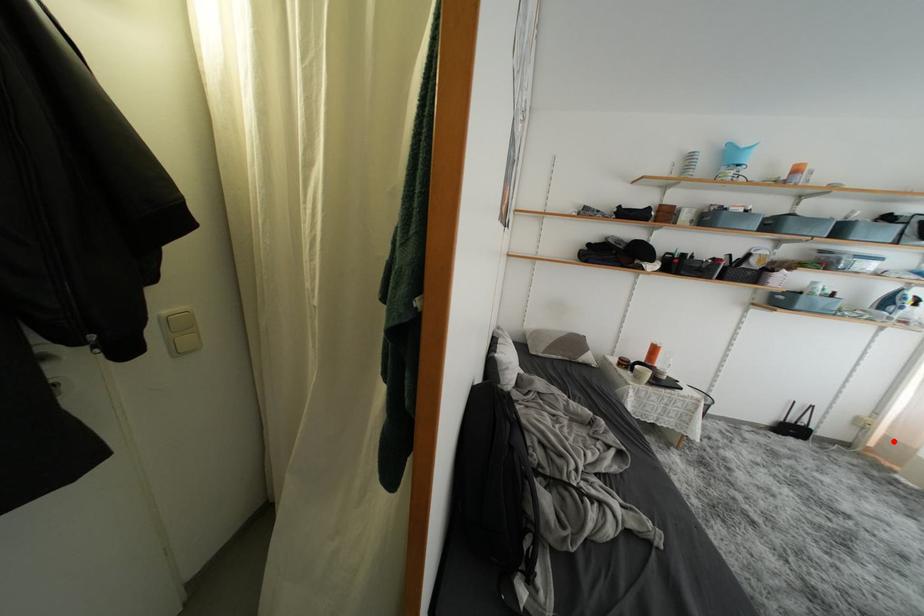
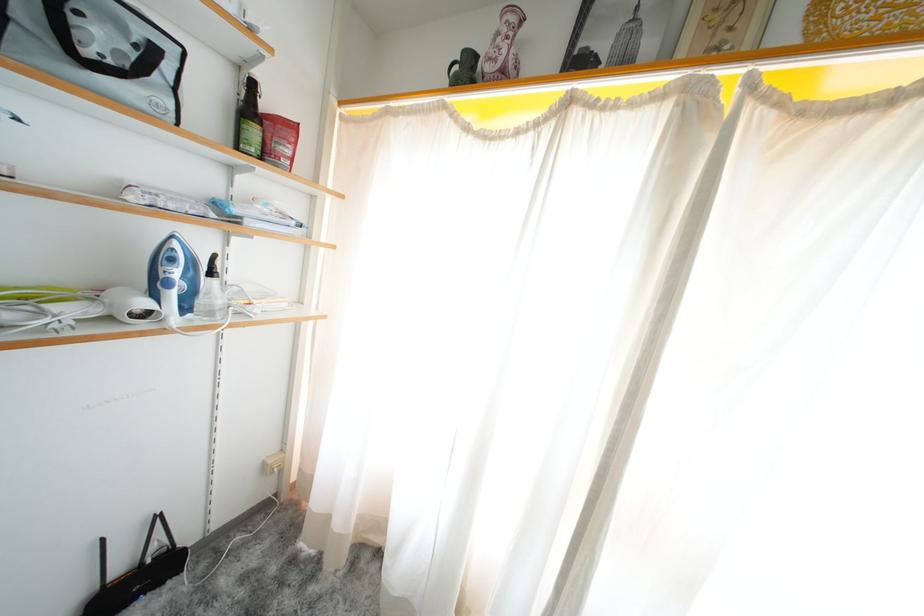
Find the pixel in the second image that matches the highlighted location in the first image.

(306, 475)